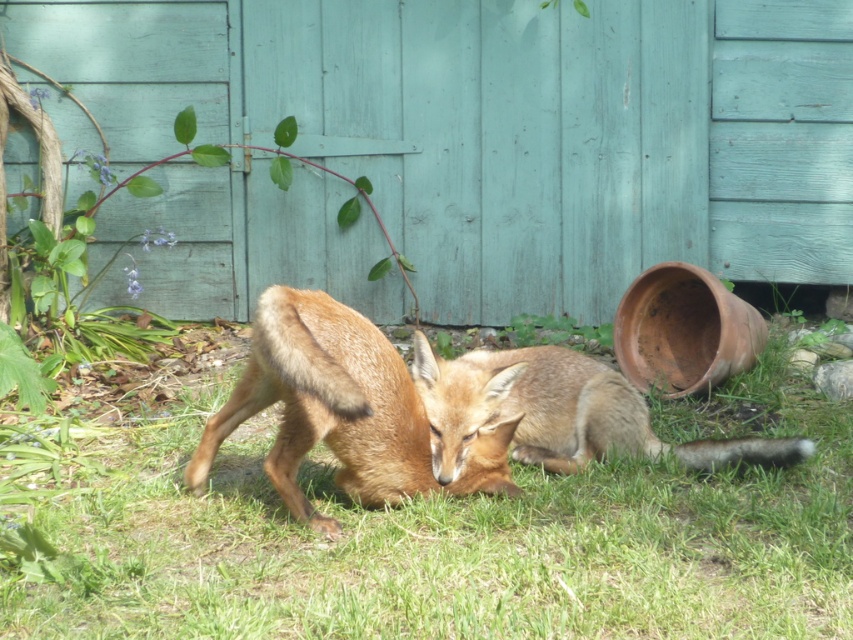
Question: Which object is farther from the camera taking this photo?

Choices:
 (A) green grass at center
 (B) brown fur fox at center

Answer: (B)

Question: Estimate the real-world distances between objects in this image. Which object is closer to the brown fur fox at center?

Choices:
 (A) green grass at center
 (B) golden fur fox at center

Answer: (B)

Question: Where is green grass at center located in relation to golden fur fox at center in the image?

Choices:
 (A) below
 (B) above

Answer: (A)

Question: In this image, where is green grass at center located relative to brown fur fox at center?

Choices:
 (A) below
 (B) above

Answer: (A)

Question: Which point is farther from the camera taking this photo?

Choices:
 (A) (413, 387)
 (B) (306, 465)
 (C) (575, 424)

Answer: (B)

Question: Is green grass at center below golden fur fox at center?

Choices:
 (A) yes
 (B) no

Answer: (A)